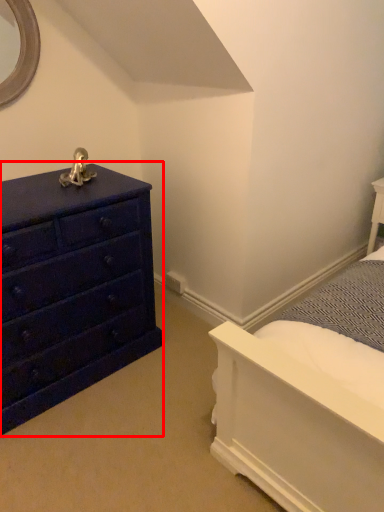
Question: Where is chest of drawers (annotated by the red box) located in relation to bedding in the image?

Choices:
 (A) left
 (B) right

Answer: (A)